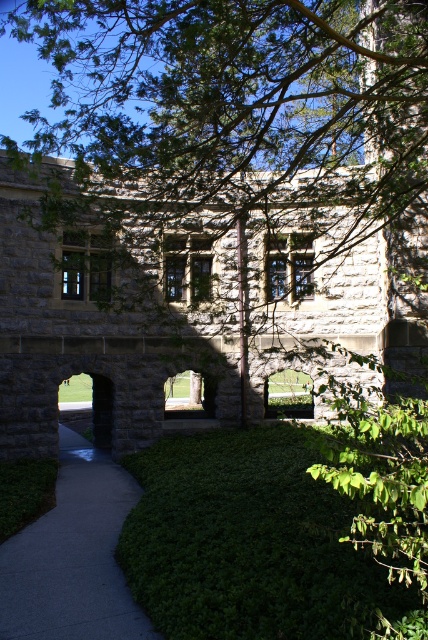
Question: Is green leafy bush at lower center thinner than gray concrete sidewalk at lower left?

Choices:
 (A) no
 (B) yes

Answer: (A)

Question: Does green leafy bush at lower center have a lesser width compared to gray concrete sidewalk at lower left?

Choices:
 (A) yes
 (B) no

Answer: (B)

Question: Can you confirm if green leafy bush at lower center is positioned below gray concrete sidewalk at lower left?

Choices:
 (A) yes
 (B) no

Answer: (B)

Question: Which point appears farthest from the camera in this image?

Choices:
 (A) (219, 472)
 (B) (23, 600)

Answer: (A)